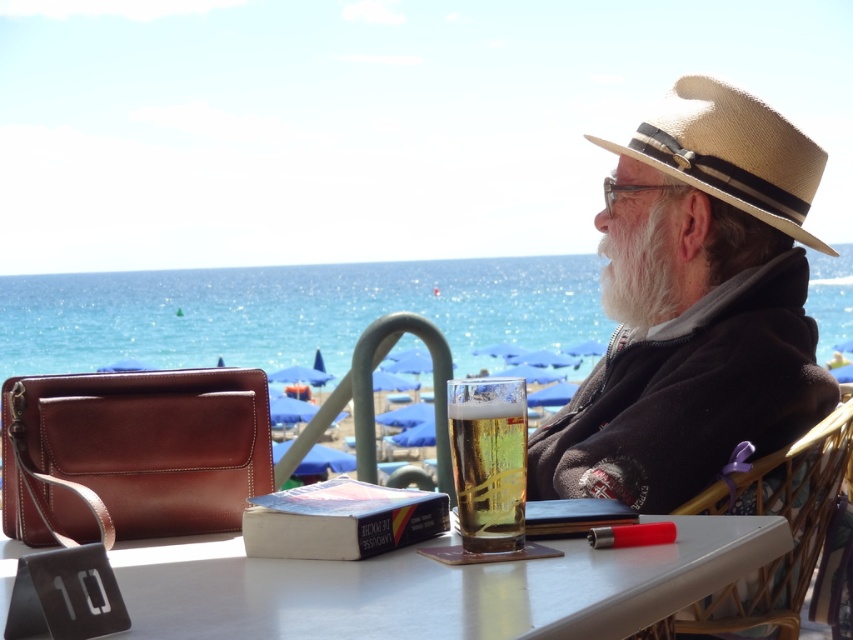
You are a photographer trying to capture the best angle of the scene. You want to ensure both the straw hat at center and the white fluffy beard at center are clearly visible in the photo. Given their sizes, which object should you focus on to ensure both are in frame without needing to adjust your camera angle?

The straw hat at center is much taller than the white fluffy beard at center, so focusing on the taller object ensures both are in frame without needing to adjust the camera angle.

You are standing at the beach and want to grab the straw hat at upper right without moving your feet. Can you reach it if your arm span is 5 feet?

The distance between you and the straw hat at upper right is 5.16 feet, which is slightly longer than your arm span of 5 feet. You might need to stretch or move slightly to reach it.

You are a photographer trying to capture the perfect shot of the straw hat at center and the white fluffy beard at center. Which object should you focus on if you want to highlight the larger one in your composition?

The straw hat at center is bigger than the white fluffy beard at center, so you should focus on the straw hat at center to highlight the larger one in your composition.